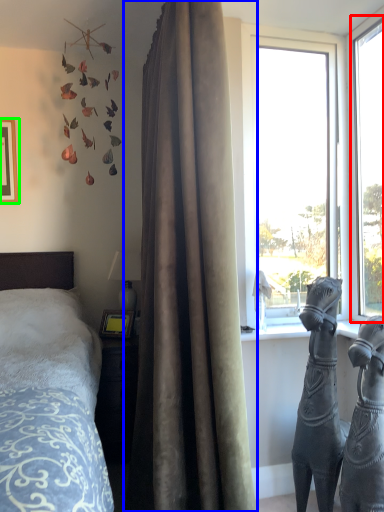
Question: Which object is positioned closest to window (highlighted by a red box)? Select from curtain (highlighted by a blue box) and picture frame (highlighted by a green box).

Choices:
 (A) curtain
 (B) picture frame

Answer: (A)